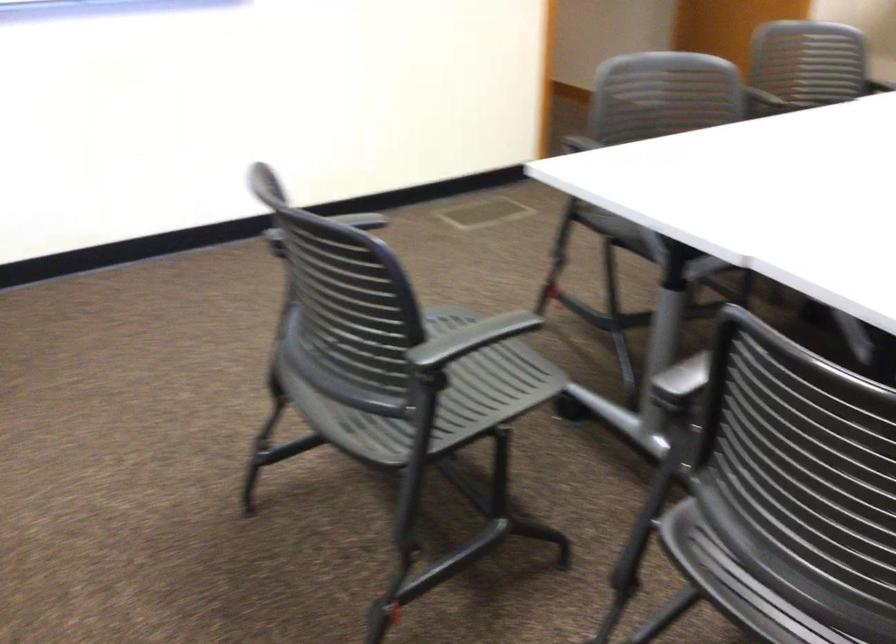
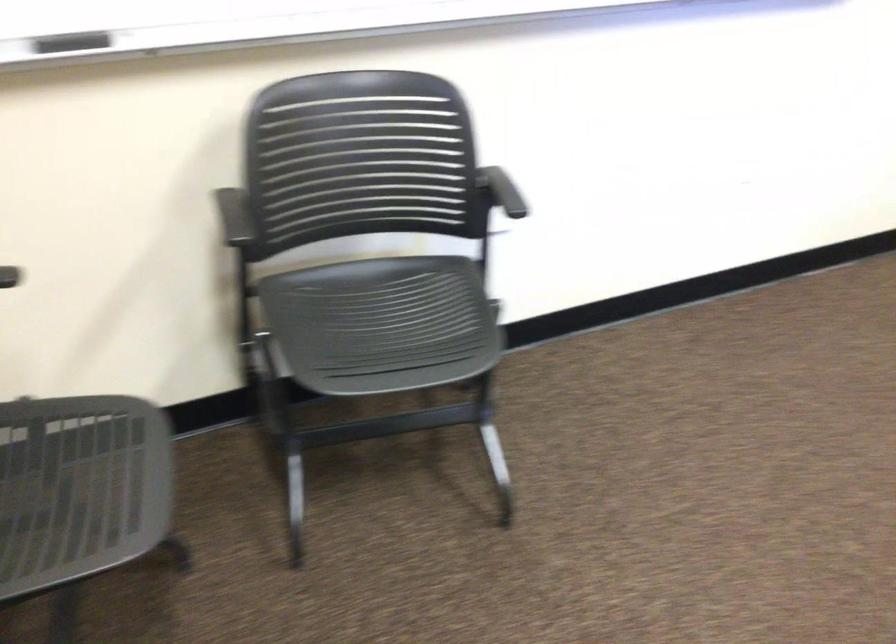
Question: The images are taken continuously from a first-person perspective. In which direction are you moving?

Choices:
 (A) Left
 (B) Right
 (C) Forward
 (D) Backward

Answer: (A)